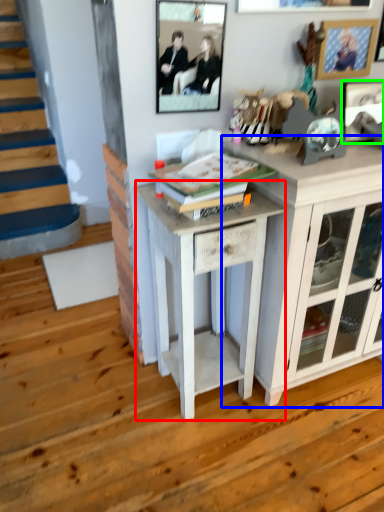
Question: Which object is positioned farthest from table (highlighted by a red box)? Select from cabinetry (highlighted by a blue box) and picture frame (highlighted by a green box).

Choices:
 (A) cabinetry
 (B) picture frame

Answer: (B)